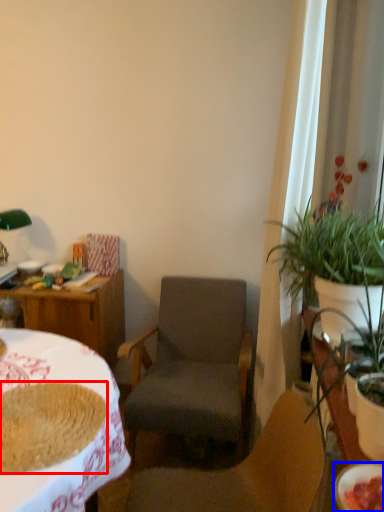
Question: Which of the following is the closest to the observer, food (highlighted by a red box) or bowl (highlighted by a blue box)?

Choices:
 (A) food
 (B) bowl

Answer: (B)